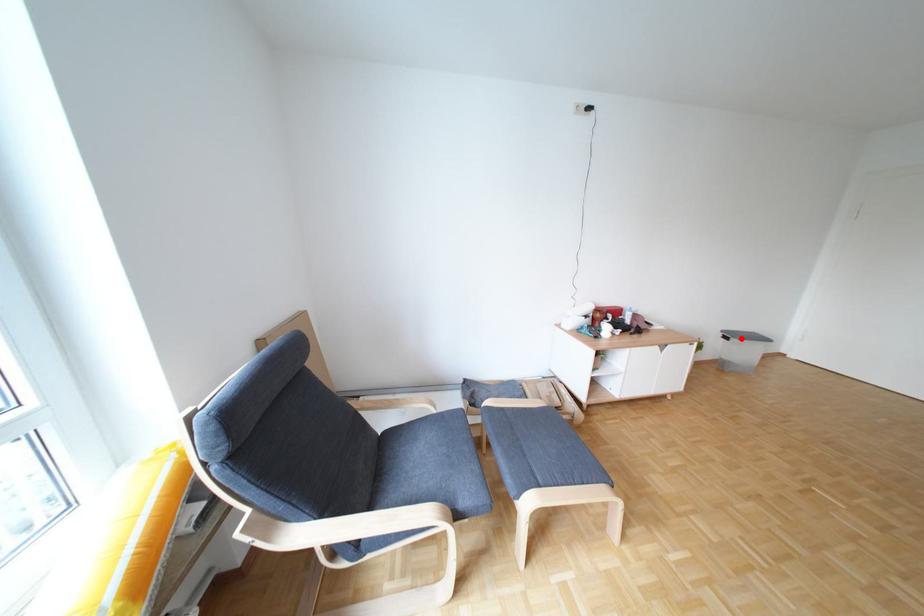
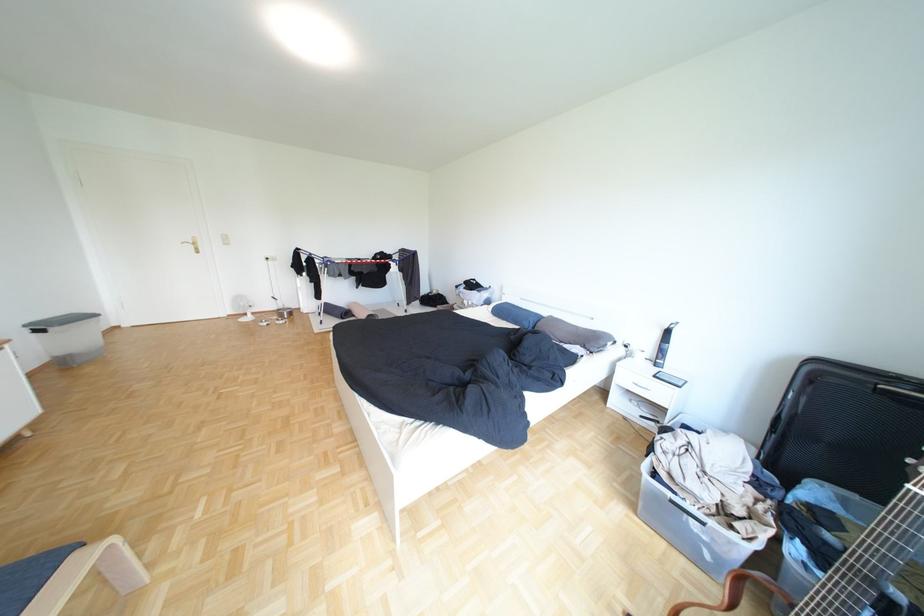
Question: A red point is marked in image1. In image2, is the corresponding 3D point closer to the camera or farther? Reply with the corresponding letter.

Choices:
 (A) The corresponding 3D point is closer.
 (B) The corresponding 3D point is farther.

Answer: (B)